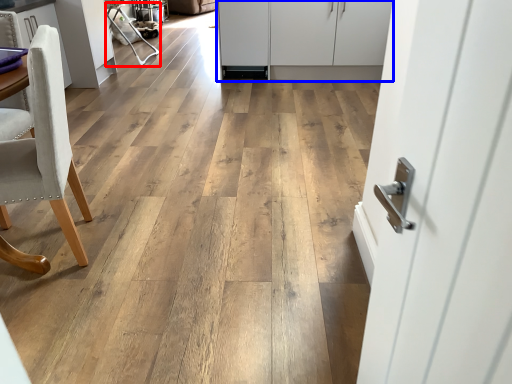
Question: Which object is further to the camera taking this photo, armchair (highlighted by a red box) or cabinetry (highlighted by a blue box)?

Choices:
 (A) armchair
 (B) cabinetry

Answer: (A)